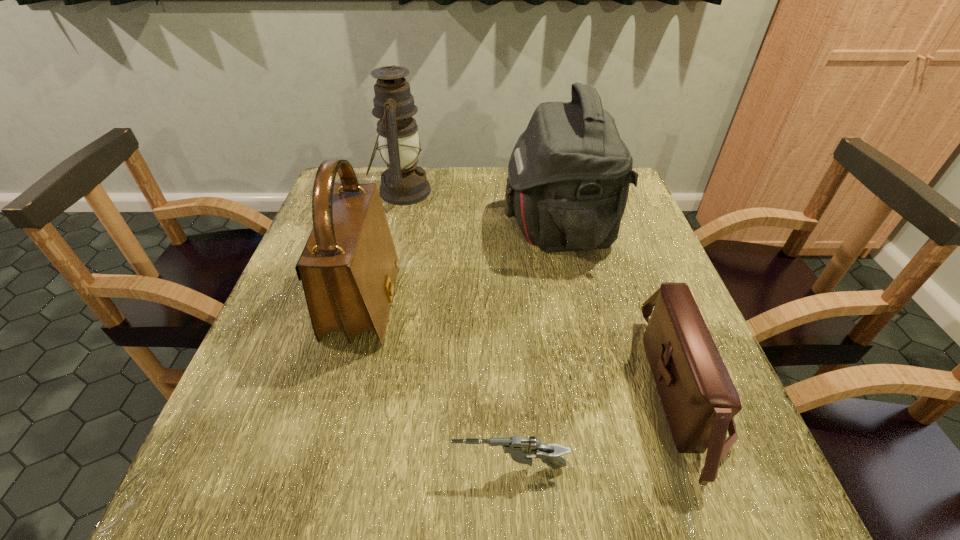
Identify the location of shoulder bag that is the third closest one to the shortest object. The width and height of the screenshot is (960, 540). (569, 173).

The width and height of the screenshot is (960, 540). I want to click on the second closest shoulder bag relative to the oil lamp, so click(348, 268).

Locate an element on the screen. This screenshot has height=540, width=960. vacant space that satisfies the following two spatial constraints: 1. on the front side of the oil lamp; 2. on the front flap of the leftmost shoulder bag is located at coordinates 375,304.